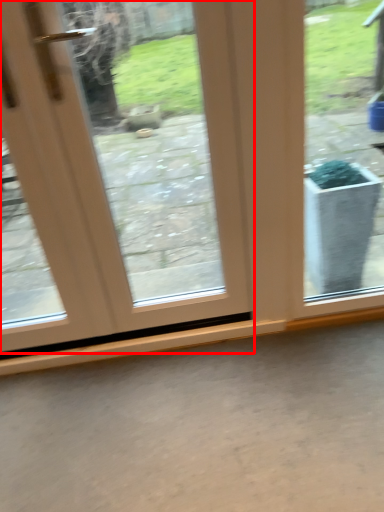
Question: From the image's perspective, what is the correct spatial relationship of door (annotated by the red box) in relation to concrete?

Choices:
 (A) above
 (B) below

Answer: (A)